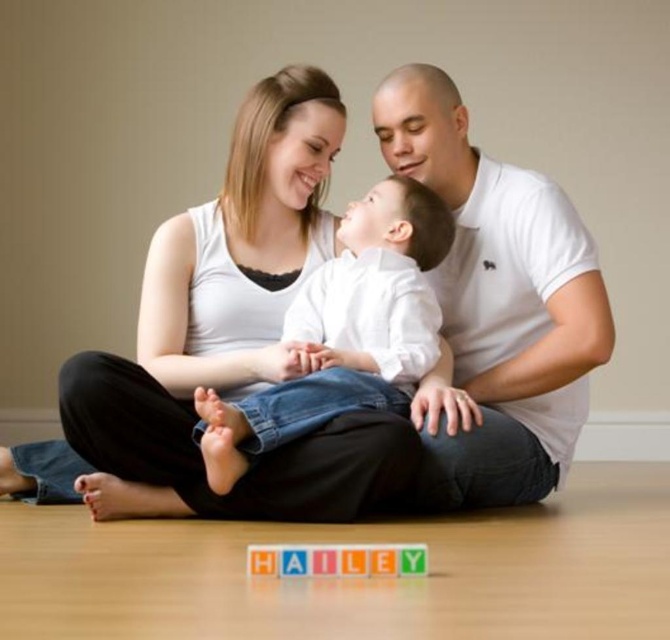
Question: Which is farther from the white cotton shirt at center?

Choices:
 (A) white smooth shirt at center
 (B) multicolored plastic blocks at center

Answer: (B)

Question: Which point is farther to the camera?

Choices:
 (A) (425, 316)
 (B) (385, 556)
 (C) (576, 416)

Answer: (C)

Question: Does white cotton shirt at center have a larger size compared to multicolored plastic blocks at center?

Choices:
 (A) no
 (B) yes

Answer: (B)

Question: Which point is closer to the camera?

Choices:
 (A) (498, 461)
 (B) (413, 186)

Answer: (A)

Question: Does white cotton shirt at center appear on the left side of white smooth shirt at center?

Choices:
 (A) yes
 (B) no

Answer: (B)

Question: Is white smooth shirt at center positioned in front of multicolored plastic blocks at center?

Choices:
 (A) yes
 (B) no

Answer: (B)